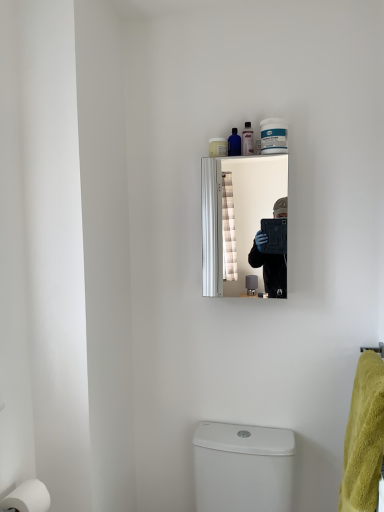
Question: From the image's perspective, is silver metallic mirror at upper center below translucent plastic soap dispenser at upper center, the first toiletry in the left-to-right sequence?

Choices:
 (A) no
 (B) yes

Answer: (B)

Question: From a real-world perspective, is silver metallic mirror at upper center on top of translucent plastic soap dispenser at upper center, the first toiletry in the left-to-right sequence?

Choices:
 (A) yes
 (B) no

Answer: (B)

Question: Can you confirm if silver metallic mirror at upper center is thinner than translucent plastic soap dispenser at upper center, the third toiletry viewed from the right?

Choices:
 (A) yes
 (B) no

Answer: (B)

Question: Does silver metallic mirror at upper center appear on the left side of translucent plastic soap dispenser at upper center, the third toiletry viewed from the right?

Choices:
 (A) yes
 (B) no

Answer: (B)

Question: Is silver metallic mirror at upper center aimed at translucent plastic soap dispenser at upper center, the first toiletry in the left-to-right sequence?

Choices:
 (A) no
 (B) yes

Answer: (A)

Question: Is translucent plastic soap dispenser at upper center, the third toiletry viewed from the right, taller or shorter than silver metallic mirror at upper center?

Choices:
 (A) short
 (B) tall

Answer: (A)

Question: From the image's perspective, relative to silver metallic mirror at upper center, is translucent plastic soap dispenser at upper center, the first toiletry in the left-to-right sequence, above or below?

Choices:
 (A) above
 (B) below

Answer: (A)

Question: In the image, is translucent plastic soap dispenser at upper center, the first toiletry in the left-to-right sequence, on the left side or the right side of silver metallic mirror at upper center?

Choices:
 (A) left
 (B) right

Answer: (A)

Question: From a real-world perspective, is translucent plastic soap dispenser at upper center, the first toiletry in the left-to-right sequence, positioned above or below silver metallic mirror at upper center?

Choices:
 (A) above
 (B) below

Answer: (A)

Question: From their relative heights in the image, would you say translucent plastic bottle at upper center, positioned as the 3th toiletry in left-to-right order, is taller or shorter than white glossy toilet at lower center?

Choices:
 (A) short
 (B) tall

Answer: (A)

Question: From the image's perspective, is translucent plastic bottle at upper center, positioned as the 1th toiletry in right-to-left order, positioned above or below white glossy toilet at lower center?

Choices:
 (A) above
 (B) below

Answer: (A)

Question: In terms of width, does translucent plastic bottle at upper center, positioned as the 1th toiletry in right-to-left order, look wider or thinner when compared to white glossy toilet at lower center?

Choices:
 (A) thin
 (B) wide

Answer: (A)

Question: Visually, is translucent plastic bottle at upper center, positioned as the 3th toiletry in left-to-right order, positioned to the left or to the right of white glossy toilet at lower center?

Choices:
 (A) left
 (B) right

Answer: (B)

Question: From the image's perspective, is translucent plastic soap dispenser at upper center, the first toiletry in the left-to-right sequence, located above or below yellow fluffy bath towel at right?

Choices:
 (A) above
 (B) below

Answer: (A)

Question: Looking at the image, does translucent plastic soap dispenser at upper center, the first toiletry in the left-to-right sequence, seem bigger or smaller compared to yellow fluffy bath towel at right?

Choices:
 (A) small
 (B) big

Answer: (A)